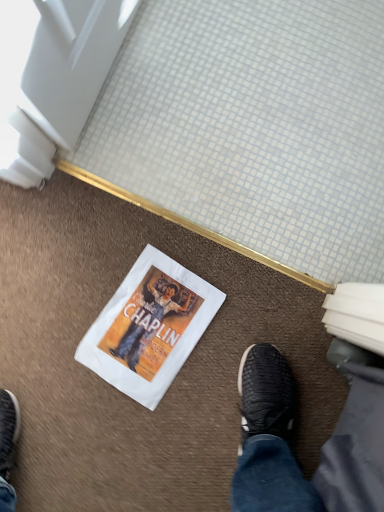
What do you see at coordinates (149, 327) in the screenshot? The image size is (384, 512). I see `white paper comic book at center` at bounding box center [149, 327].

At what (x,y) coordinates should I click in order to perform the action: click on white paper comic book at center. Please return your answer as a coordinate pair (x, y). The image size is (384, 512). Looking at the image, I should click on (149, 327).

In order to face white paper comic book at center, should I rotate leftwards or rightwards?

To face it directly, rotate left by 5.656 degrees.

The width and height of the screenshot is (384, 512). Find the location of `white paper comic book at center`. white paper comic book at center is located at coordinates (149, 327).